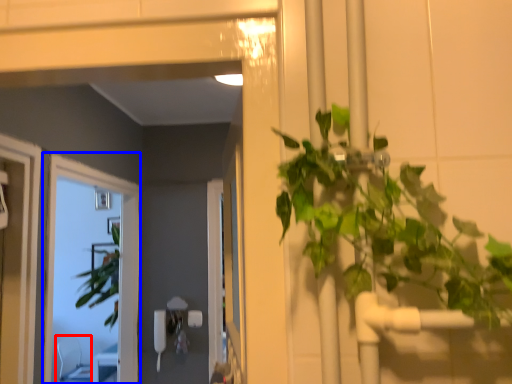
Question: Which object is further to the camera taking this photo, chair (highlighted by a red box) or window (highlighted by a blue box)?

Choices:
 (A) chair
 (B) window

Answer: (A)